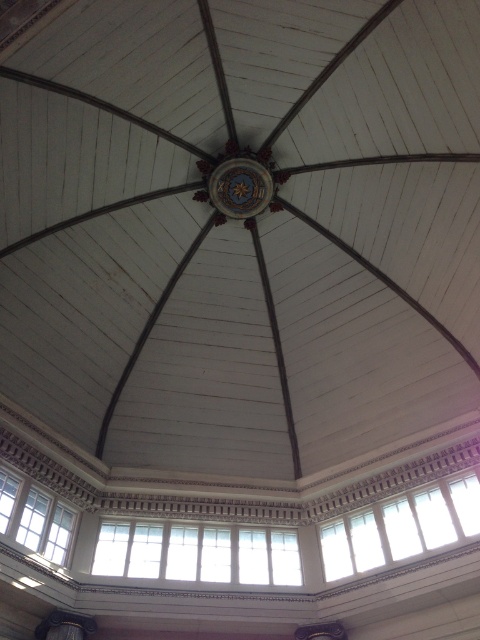
Does point (454, 496) come farther from viewer compared to point (68, 512)?

No, it is in front of (68, 512).

Does white glass window at lower center appear on the left side of clear glass windows at lower left?

In fact, white glass window at lower center is to the right of clear glass windows at lower left.

Which is behind, point (437, 502) or point (32, 500)?

The point (437, 502) is behind.

This screenshot has height=640, width=480. In order to click on white glass window at lower center in this screenshot , I will do `click(400, 528)`.

Who is higher up, white glass windows at center or gold metallic clock at center?

gold metallic clock at center

Can you confirm if white glass windows at center is positioned to the left of gold metallic clock at center?

Yes, white glass windows at center is to the left of gold metallic clock at center.

Which is behind, point (133, 563) or point (229, 198)?

The point (229, 198) is more distant.

Identify the location of white glass windows at center. (197, 554).

Is point (275, 576) positioned before point (46, 497)?

That is False.

This screenshot has height=640, width=480. I want to click on white glass windows at center, so click(197, 554).